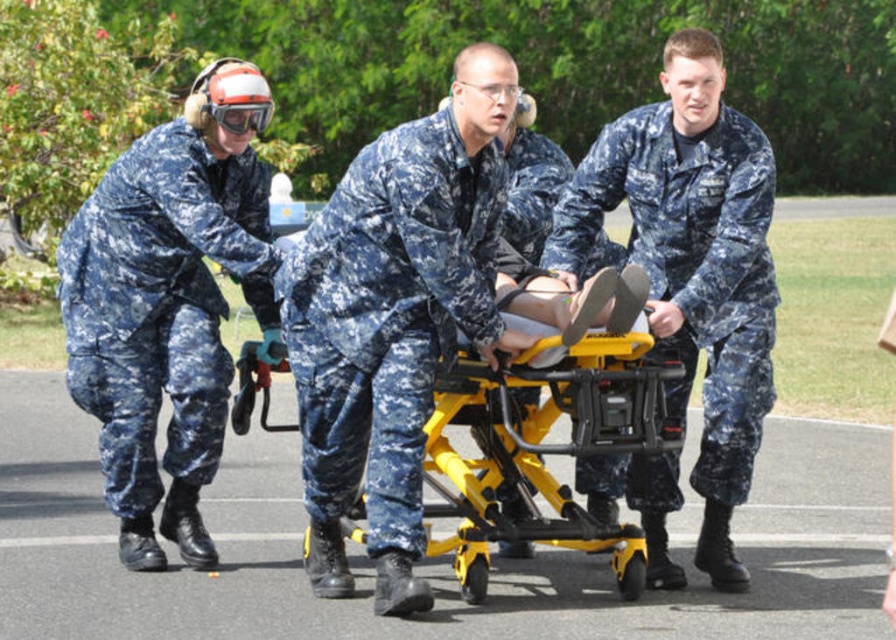
You are a photographer trying to capture a clear photo of the camouflage uniform at center and the yellow metallic stretcher at center. Based on their sizes, which one will appear wider in the photo?

The yellow metallic stretcher at center is wider than the camouflage uniform at center, so it will appear wider in the photo.

You are a drone operator trying to locate a specific object in the scene. The scene has a camouflage uniform at center. Can you confirm if the camouflage uniform at center is exactly at the point coordinates of (394,320)?

Yes, the camouflage uniform at center is exactly at the point coordinates of (394,320).

You are a medical responder in a disaster area. You need to move an injured person on the yellow metallic stretcher at center through a narrow corridor. The corridor is only as wide as the camouflage fabric uniform at center. Can the stretcher fit through?

The camouflage fabric uniform at center is thinner than the yellow metallic stretcher at center, so the stretcher cannot fit through the corridor which is only as wide as the uniform.